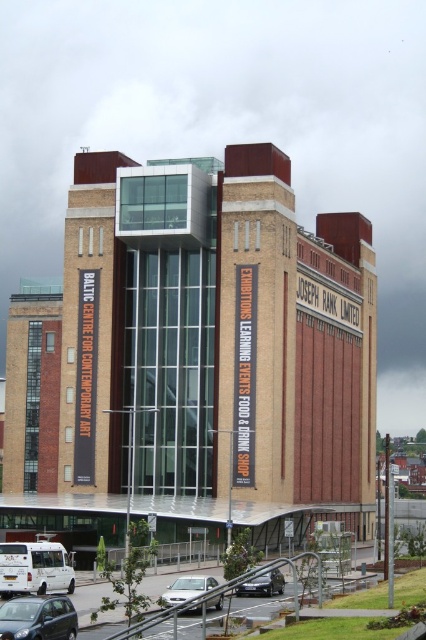
You are standing in front of the modern building and want to determine the relative positions of two points marked on the facade. Which point, point 1 at coordinates (60, 627) or point 2 at coordinates (261, 577), is closer to you?

Point 1 at coordinates (60, 627) is closer to the viewer than point 2 at coordinates (261, 577).

You are a visitor arriving at the Baltic Centre for Contemporary Art. You have a small car that you want to park in the parking lot near the building. The parking spaces here are all the same size. You see a metallic gray hatchback at lower left and a silver metallic sedan at lower center already parked. Which car takes up more space in its parking spot?

The silver metallic sedan at lower center takes up more space in its parking spot because the metallic gray hatchback at lower left occupies less space than it.